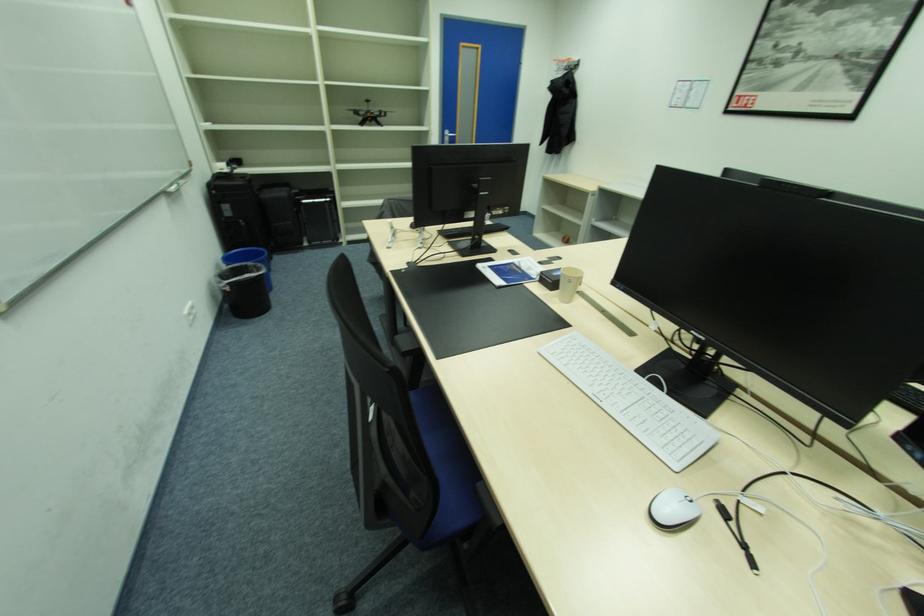
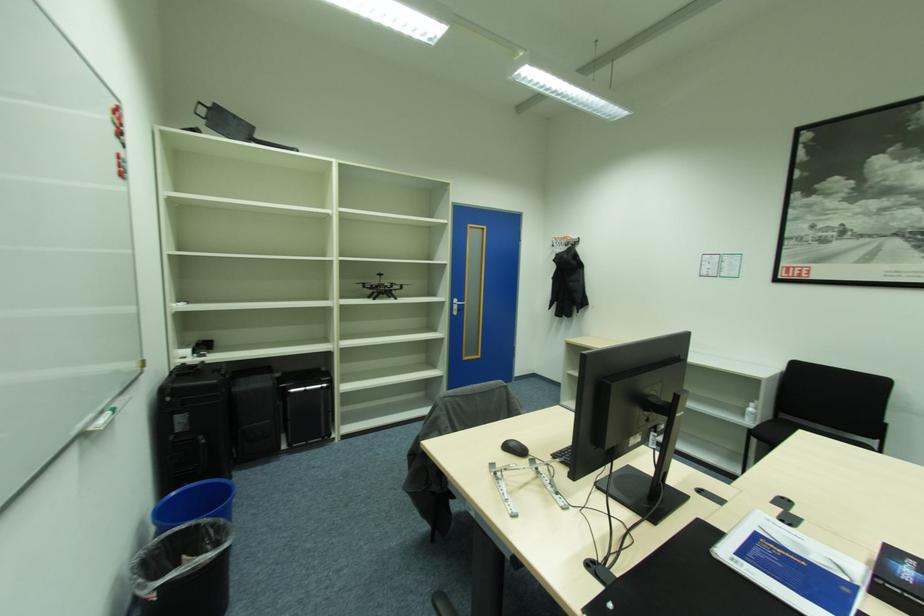
In a continuous first-person perspective shot, in which direction is the camera moving?

The cameraman walked toward left, forward.